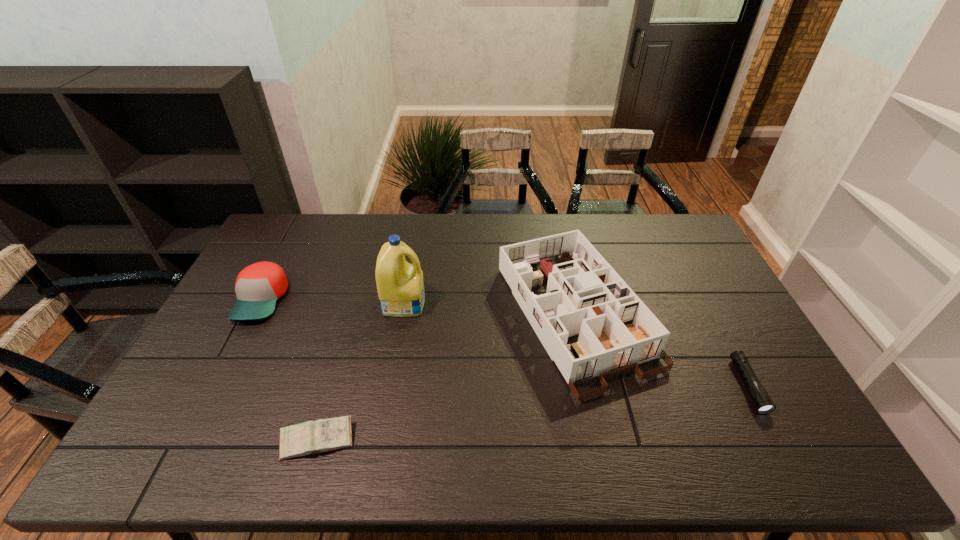
Find the location of a particular element. detergent is located at coordinates (400, 285).

The height and width of the screenshot is (540, 960). Identify the location of dollhouse. (585, 296).

At what (x,y) coordinates should I click in order to perform the action: click on baseball cap. Please return your answer as a coordinate pair (x, y). Looking at the image, I should click on (258, 286).

This screenshot has width=960, height=540. In order to click on the second shortest object in this screenshot , I will do `click(311, 437)`.

The image size is (960, 540). Find the location of `diary`. diary is located at coordinates (311, 437).

At what (x,y) coordinates should I click in order to perform the action: click on the rightmost object. Please return your answer as a coordinate pair (x, y). Looking at the image, I should click on (761, 400).

What are the coordinates of `flashlight` in the screenshot? It's located at (761, 400).

Where is `vacant space situated on the label of the tallest object`? This screenshot has width=960, height=540. vacant space situated on the label of the tallest object is located at coordinates (535, 302).

At what (x,y) coordinates should I click in order to perform the action: click on vacant space located 0.160m on the left of the fourth object from left to right. Please return your answer as a coordinate pair (x, y). This screenshot has width=960, height=540. Looking at the image, I should click on (449, 315).

Locate an element on the screen. The height and width of the screenshot is (540, 960). vacant region located at the brim of the leftmost object is located at coordinates coord(195,427).